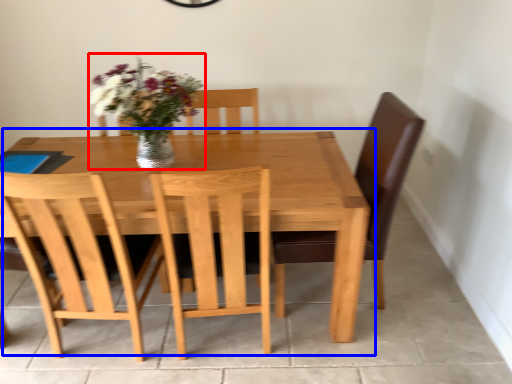
Question: Among these objects, which one is farthest to the camera, floral arrangement (highlighted by a red box) or kitchen & dining room table (highlighted by a blue box)?

Choices:
 (A) floral arrangement
 (B) kitchen & dining room table

Answer: (B)